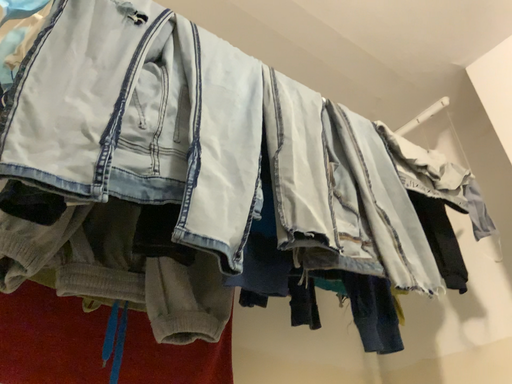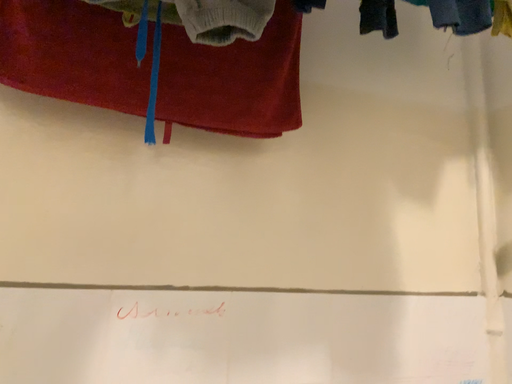
Question: How did the camera likely rotate when shooting the video?

Choices:
 (A) rotated upward
 (B) rotated downward

Answer: (B)